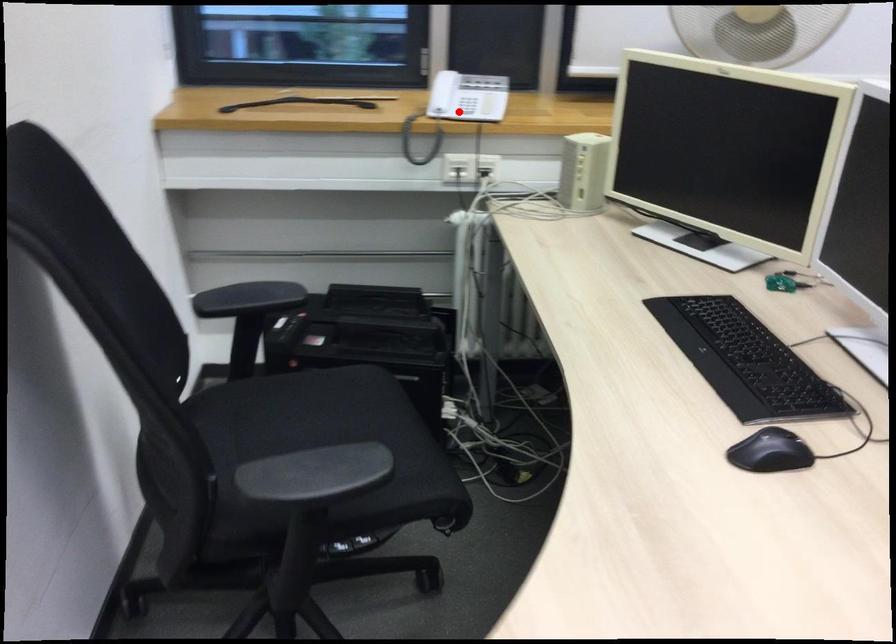
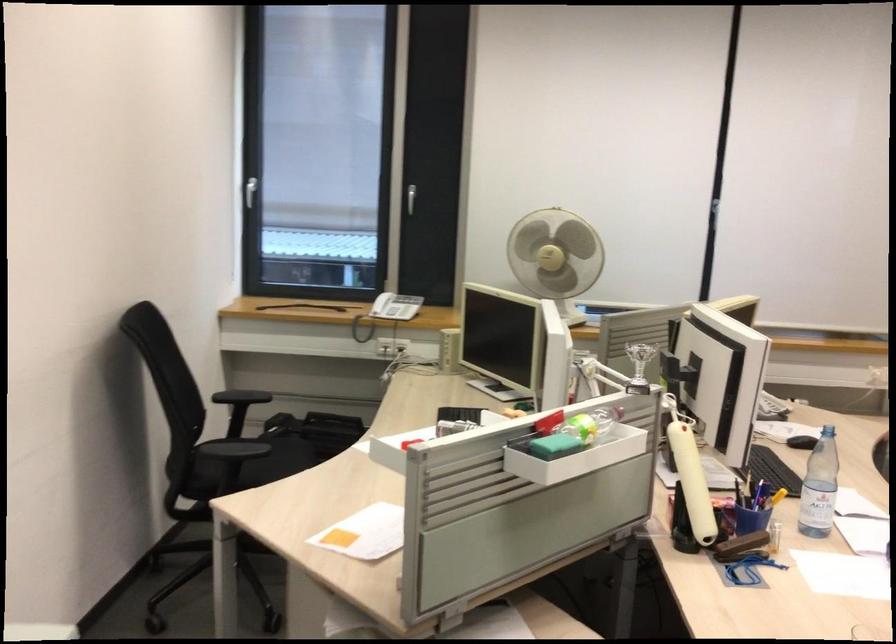
Question: I am providing you with two images of the same scene from different viewpoints. In image1, a red point is highlighted. Considering the same 3D point in image2, which of the following is correct?

Choices:
 (A) It is closer
 (B) It is farther

Answer: (B)